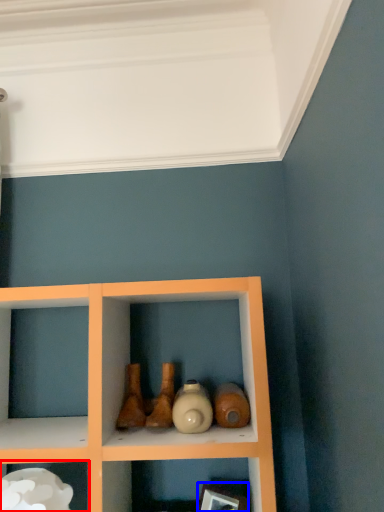
Question: Which object appears closest to the camera in this image, shelf (highlighted by a red box) or picture frame (highlighted by a blue box)?

Choices:
 (A) shelf
 (B) picture frame

Answer: (A)